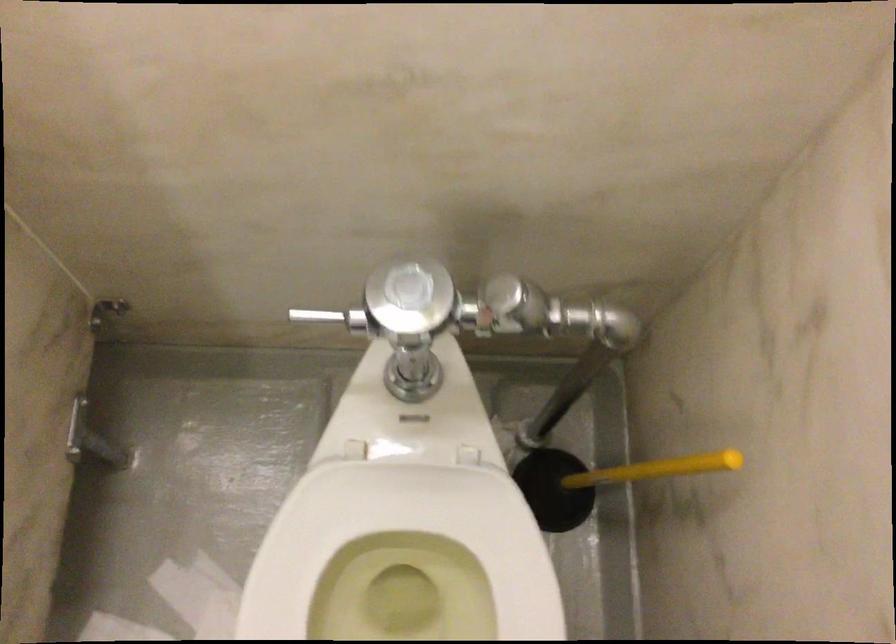
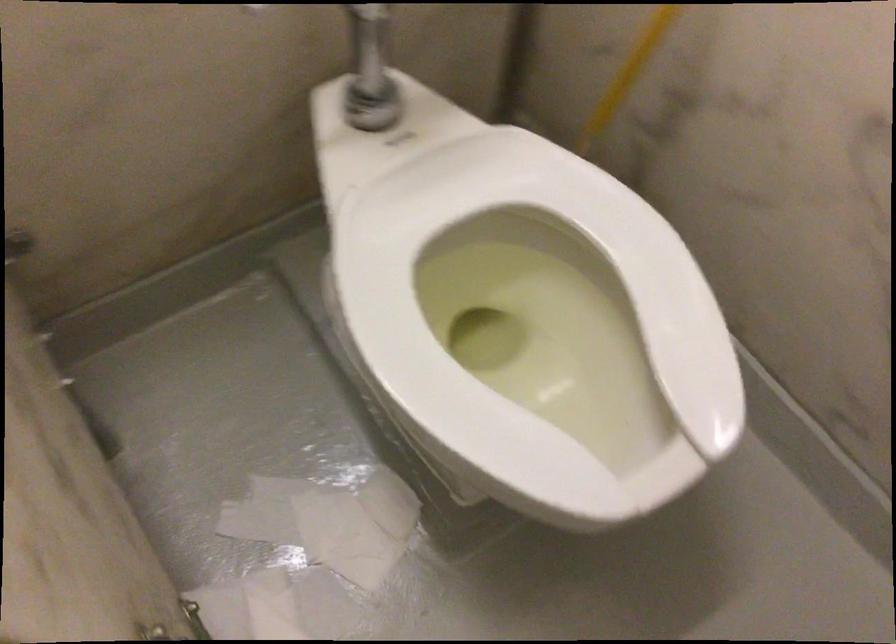
Find the pixel in the second image that matches [391,366] in the first image.

(362, 96)